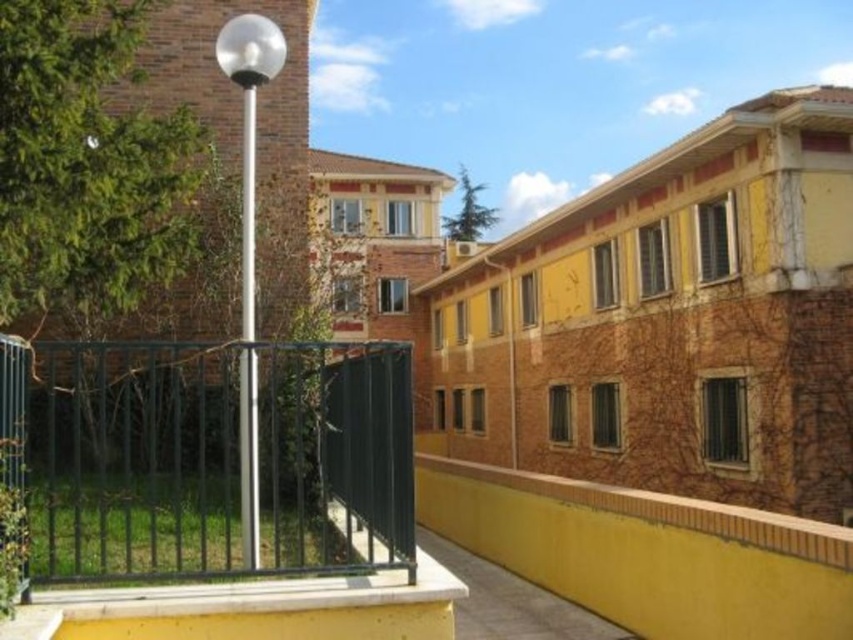
You are standing at the point marked by the coordinates point [248,122] in the residential area. What object are you directly facing?

The point [248,122] indicates a silver metallic pole at center, so you are directly facing the silver metallic pole at center.

You are standing in the residential area shown in the image. There is a green metal fence at lower left located at point (207, 456). Where is the green metal fence at lower left in the image?

The green metal fence at lower left is located at point (207, 456) in the image.

You are a painter standing at the center of the residential area. You need to paint two poles, the silver metallic pole at center and the polished metal pole at center. If your paint can only cover an area within a 10 inch radius, can you paint both poles without moving your position?

The silver metallic pole at center is 10.41 inches from the polished metal pole at center. Since the distance between them is greater than 10 inches, you cannot paint both poles without moving your position as the required coverage exceeds the 10 inch radius.